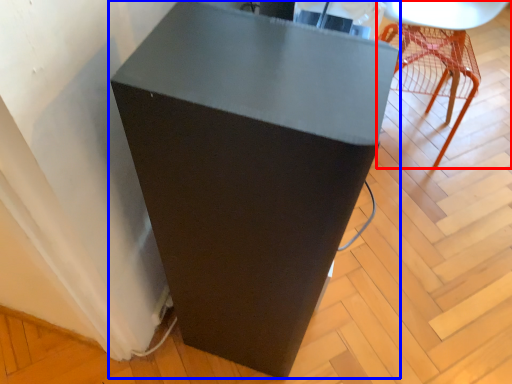
Question: Which point is closer to the camera, furniture (highlighted by a red box) or furniture (highlighted by a blue box)?

Choices:
 (A) furniture
 (B) furniture

Answer: (B)